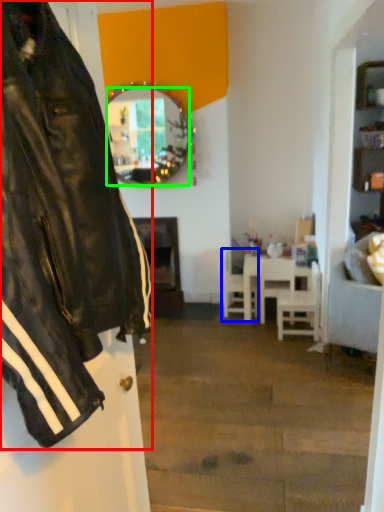
Question: Based on their relative distances, which object is nearer to jacket (highlighted by a red box)? Choose from chair (highlighted by a blue box) and mirror (highlighted by a green box).

Choices:
 (A) chair
 (B) mirror

Answer: (B)